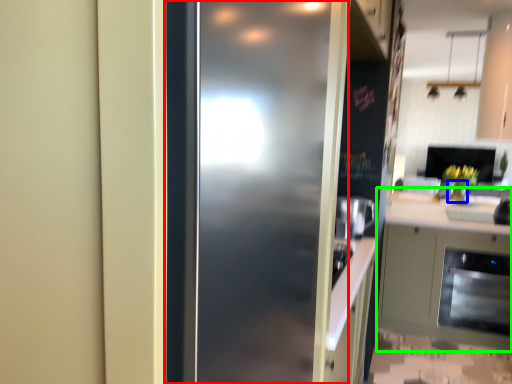
Question: Which object is the closest to the door (highlighted by a red box)? Choose among these: vase (highlighted by a blue box) or cabinetry (highlighted by a green box).

Choices:
 (A) vase
 (B) cabinetry

Answer: (B)